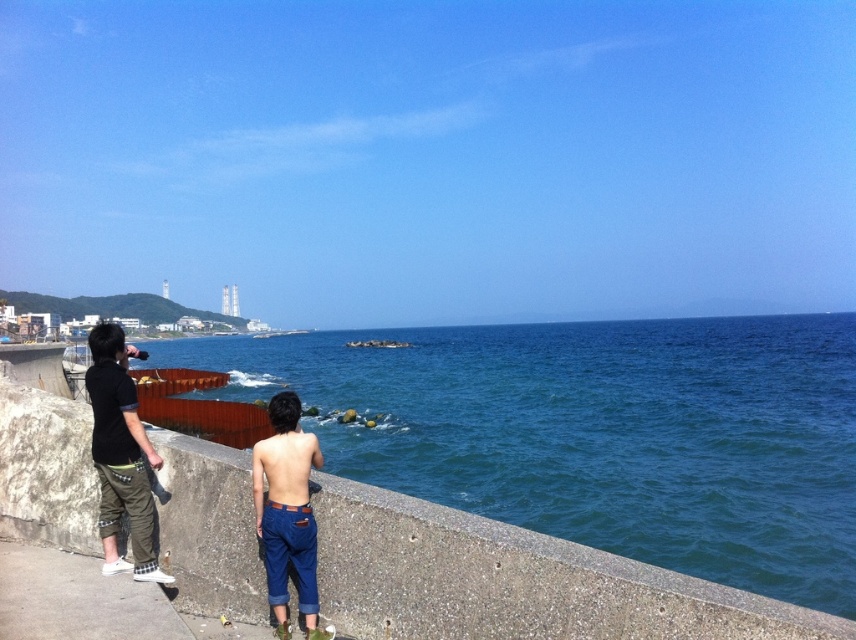
Who is more distant from viewer, (736, 509) or (135, 454)?

The point (736, 509) is more distant.

Can you confirm if blue water at center is shorter than black cotton shirt at left?

Incorrect, blue water at center's height does not fall short of black cotton shirt at left's.

Who is more forward, (474,465) or (90,390)?

Point (90,390) is more forward.

Locate an element on the screen. blue water at center is located at coordinates (597, 433).

Image resolution: width=856 pixels, height=640 pixels. What do you see at coordinates (597, 433) in the screenshot?
I see `blue water at center` at bounding box center [597, 433].

Does point (409, 364) come farther from viewer compared to point (265, 541)?

That is True.

Where is `blue water at center`? blue water at center is located at coordinates (597, 433).

Identify the location of black cotton shirt at left. The image size is (856, 640). (120, 456).

Does black cotton shirt at left appear on the left side of denim pants at center?

Correct, you'll find black cotton shirt at left to the left of denim pants at center.

This screenshot has width=856, height=640. Describe the element at coordinates (120, 456) in the screenshot. I see `black cotton shirt at left` at that location.

Image resolution: width=856 pixels, height=640 pixels. In order to click on black cotton shirt at left in this screenshot , I will do `click(120, 456)`.